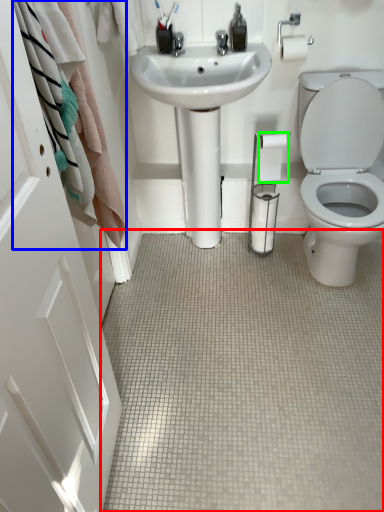
Question: Which is nearer to the plain (highlighted by a red box)? bath towel (highlighted by a blue box) or toilet paper (highlighted by a green box).

Choices:
 (A) bath towel
 (B) toilet paper

Answer: (A)